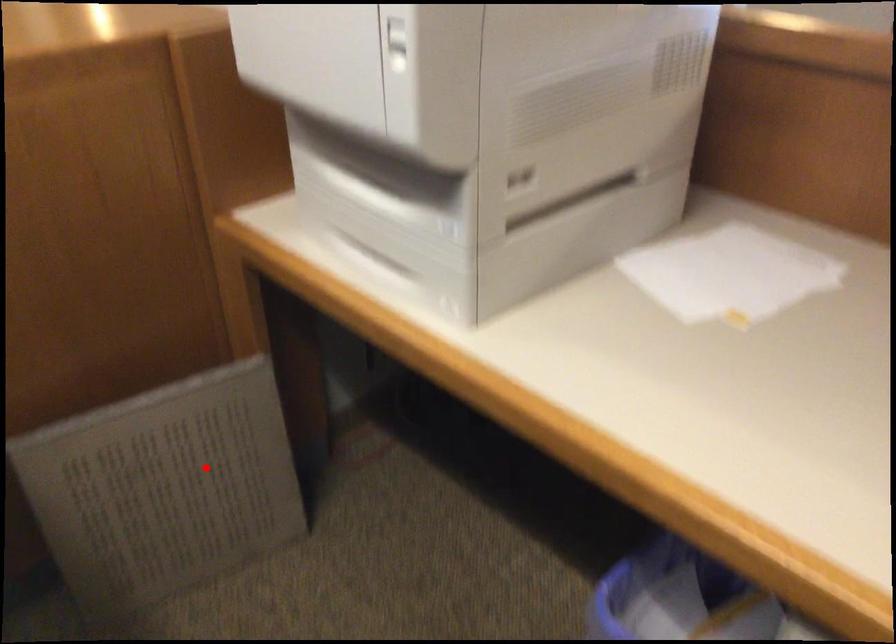
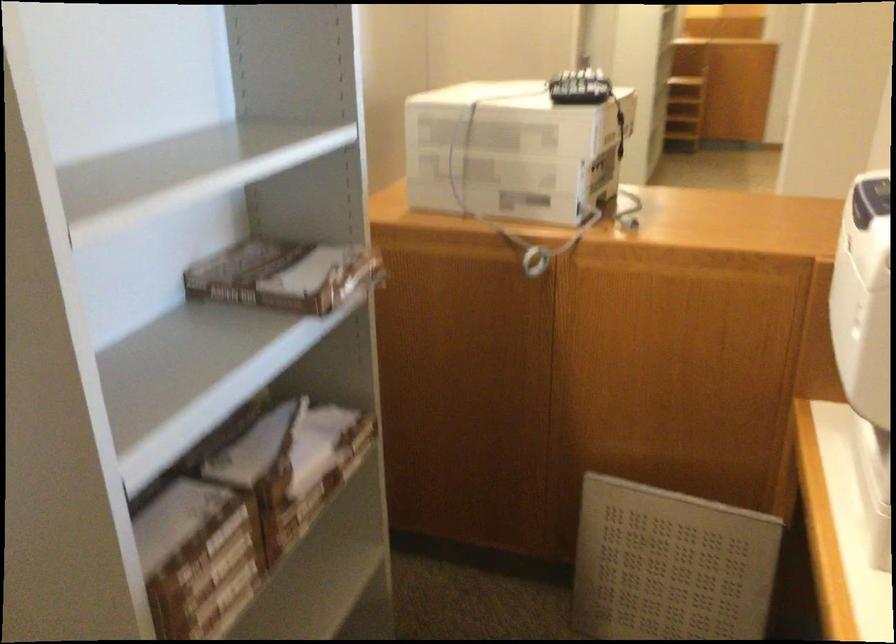
Question: I am providing you with two images of the same scene from different viewpoints. Image1 has a red point marked. In image2, the corresponding 3D location appears at what relative position? Reply with the corresponding letter.

Choices:
 (A) Closer
 (B) Farther

Answer: (B)